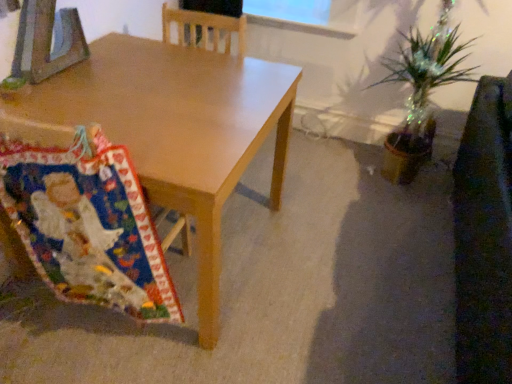
This screenshot has height=384, width=512. Identify the location of free space to the right of matte wood desk at center. (336, 256).